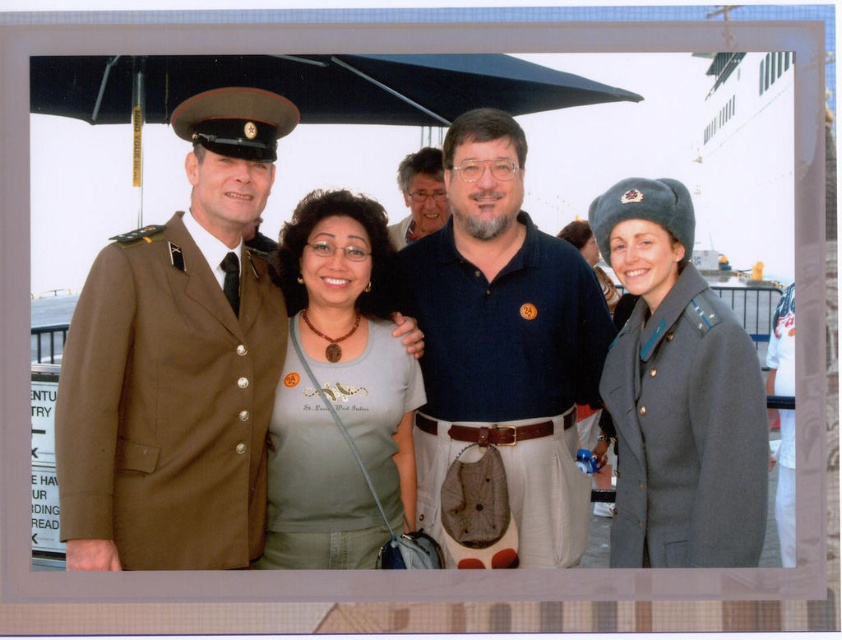
Does white cotton shirt at center appear under matte black shirt at center?

Yes, white cotton shirt at center is below matte black shirt at center.

The width and height of the screenshot is (842, 640). Describe the element at coordinates (784, 483) in the screenshot. I see `white cotton shirt at center` at that location.

Locate an element on the screen. The width and height of the screenshot is (842, 640). white cotton shirt at center is located at coordinates (784, 483).

This screenshot has height=640, width=842. Describe the element at coordinates (168, 404) in the screenshot. I see `brown woolen uniform at left` at that location.

Which is behind, point (237, 509) or point (368, 333)?

The point (368, 333) is behind.

This screenshot has width=842, height=640. I want to click on brown woolen uniform at left, so click(168, 404).

Is matte brown uniform at left behind black matte canopy at upper center?

Yes, it is.

Is point (134, 456) farther from viewer compared to point (49, 74)?

No.

This screenshot has width=842, height=640. What do you see at coordinates (179, 362) in the screenshot? I see `matte brown uniform at left` at bounding box center [179, 362].

What are the coordinates of `matte brown uniform at left` in the screenshot? It's located at (179, 362).